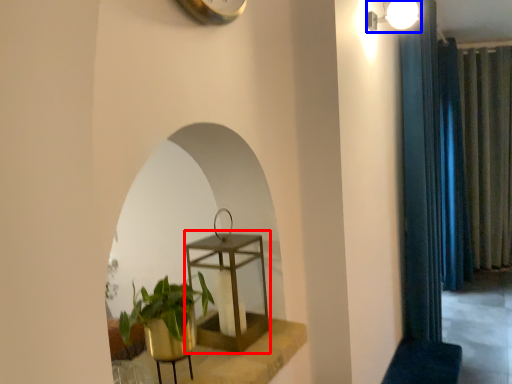
Question: Which object is closer to the camera taking this photo, round table (highlighted by a red box) or light fixture (highlighted by a blue box)?

Choices:
 (A) round table
 (B) light fixture

Answer: (A)